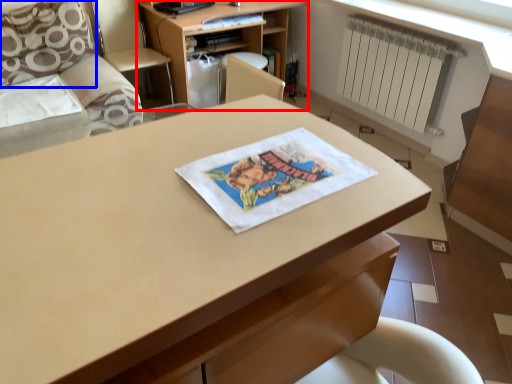
Question: Which of the following is the farthest to the observer, shelf (highlighted by a red box) or pillow (highlighted by a blue box)?

Choices:
 (A) shelf
 (B) pillow

Answer: (A)